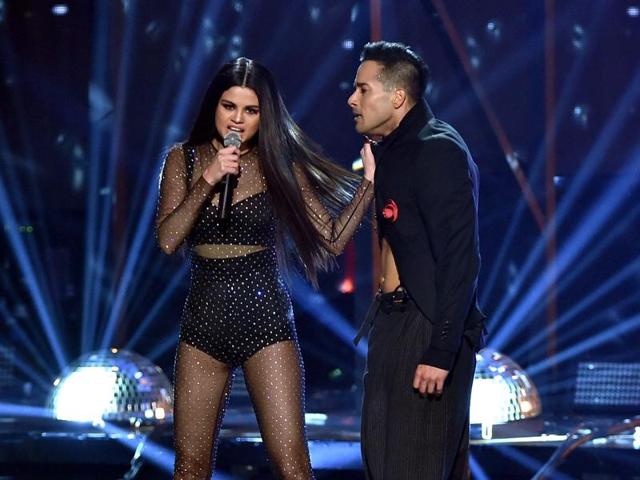
The image size is (640, 480). I want to click on 2 disco balls, so click(497, 402), click(139, 383).